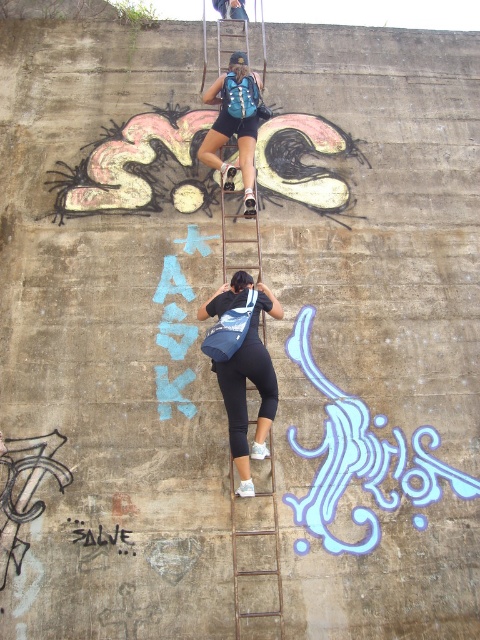
You are trying to reach the top of the rusty metal ladder at center while carrying the blue fabric backpack at center. Is the ladder tall enough for you to climb safely?

The rusty metal ladder at center is taller than the blue fabric backpack at center, so yes, the ladder is tall enough for you to climb safely.